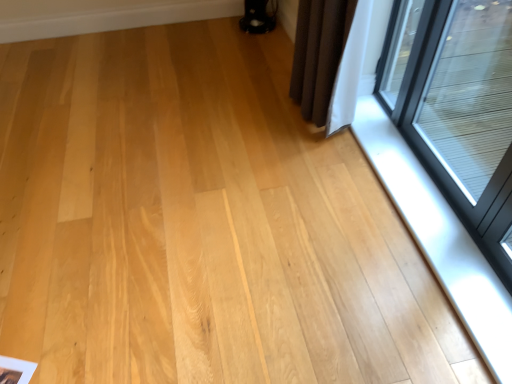
Locate an element on the screen. The image size is (512, 384). free point below transparent glass window at upper right (from a real-world perspective) is located at coordinates (403, 147).